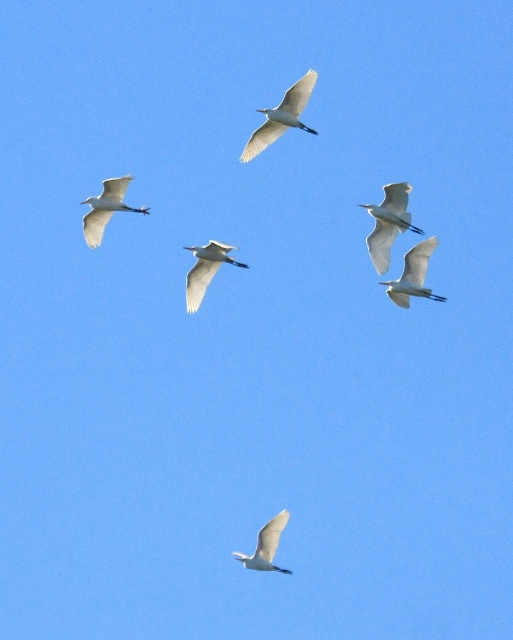
Question: Considering the relative positions of white feathered bird at upper center and white feathered bird at lower center in the image provided, where is white feathered bird at upper center located with respect to white feathered bird at lower center?

Choices:
 (A) left
 (B) right

Answer: (B)

Question: Is white feathered bird at center to the left of white feathered bird at upper left from the viewer's perspective?

Choices:
 (A) no
 (B) yes

Answer: (A)

Question: Which object appears farthest from the camera in this image?

Choices:
 (A) white matte bird at center
 (B) white feathered bird at center
 (C) white feathered bird at lower center

Answer: (C)

Question: Which object is the closest to the white feathered bird at upper left?

Choices:
 (A) white matte bird at center
 (B) white feathered bird at lower center
 (C) white feathered bird at center

Answer: (A)

Question: Which point is closer to the camera taking this photo?

Choices:
 (A) (305, 102)
 (B) (103, 205)
 (C) (285, 524)

Answer: (A)

Question: In this image, where is white feathered bird at upper right located relative to white feathered bird at center?

Choices:
 (A) above
 (B) below

Answer: (A)